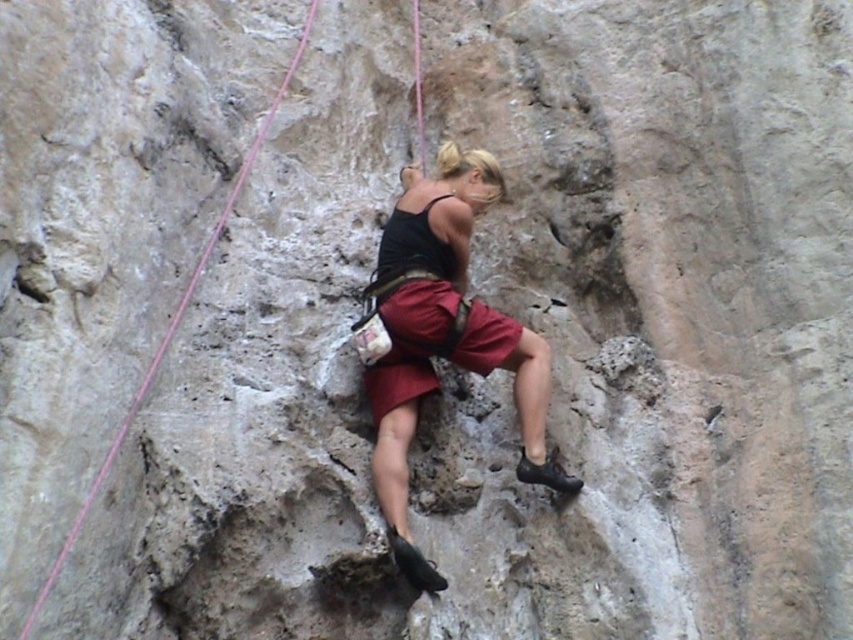
Question: Which point appears farthest from the camera in this image?

Choices:
 (A) (436, 307)
 (B) (410, 316)

Answer: (A)

Question: Is matte black tank top at center bigger than matte red shorts at center?

Choices:
 (A) no
 (B) yes

Answer: (B)

Question: Among these points, which one is nearest to the camera?

Choices:
 (A) (444, 257)
 (B) (425, 324)

Answer: (B)

Question: Can you confirm if matte black tank top at center is positioned to the right of matte red shorts at center?

Choices:
 (A) no
 (B) yes

Answer: (B)

Question: Is matte black tank top at center positioned in front of matte red shorts at center?

Choices:
 (A) yes
 (B) no

Answer: (A)